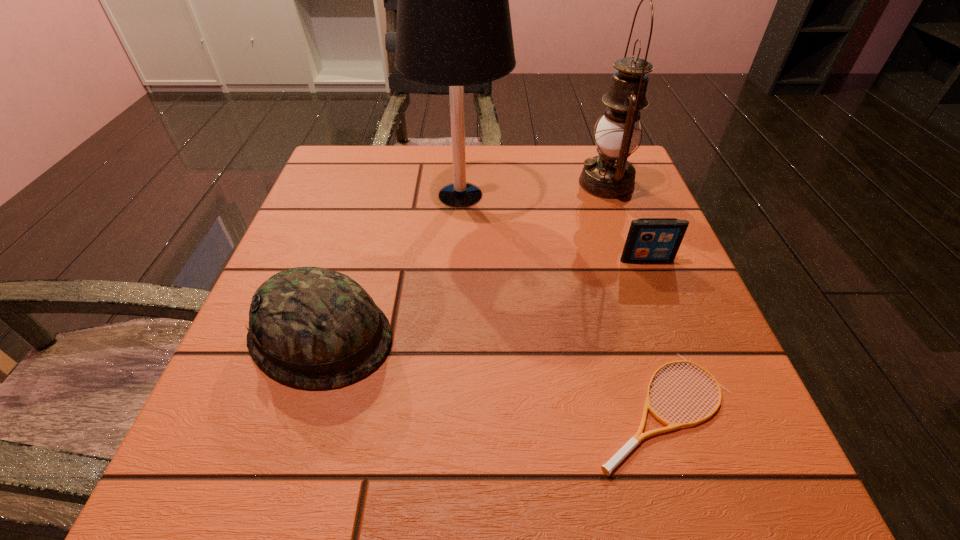
I want to click on free space located 0.140m on the left of the tennis racket, so click(487, 410).

You are a GUI agent. You are given a task and a screenshot of the screen. Output one action in this format:
    pyautogui.click(x=<x>, y=<y>)
    Task: Click on the table lamp that is positioned at the far edge
    The height and width of the screenshot is (540, 960).
    Given the screenshot: What is the action you would take?
    pyautogui.click(x=453, y=29)

I want to click on oil lamp located in the far edge section of the desktop, so click(x=609, y=175).

Where is `object present at the near edge`? object present at the near edge is located at coordinates click(607, 468).

Where is `object that is at the left edge`? object that is at the left edge is located at coordinates (312, 327).

Where is `oil lamp located in the right edge section of the desktop`? Image resolution: width=960 pixels, height=540 pixels. oil lamp located in the right edge section of the desktop is located at coordinates (609, 175).

Locate an element on the screen. This screenshot has height=540, width=960. iPod located at the right edge is located at coordinates (650, 240).

Image resolution: width=960 pixels, height=540 pixels. In order to click on tennis racket present at the right edge in this screenshot , I will do `click(607, 468)`.

Where is `object that is at the far right corner`? object that is at the far right corner is located at coordinates (609, 175).

This screenshot has height=540, width=960. What are the coordinates of `object present at the near right corner` in the screenshot? It's located at (607, 468).